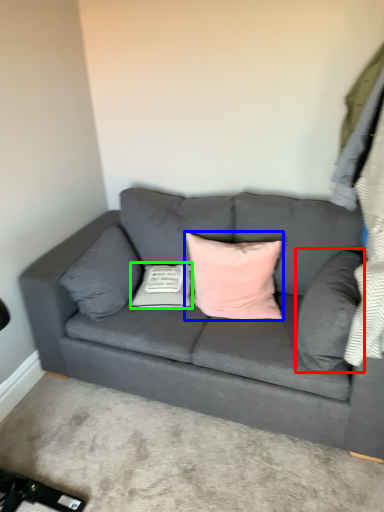
Question: Which object is the closest to the pillow (highlighted by a red box)? Choose among these: pillow (highlighted by a blue box) or pillow (highlighted by a green box).

Choices:
 (A) pillow
 (B) pillow

Answer: (A)